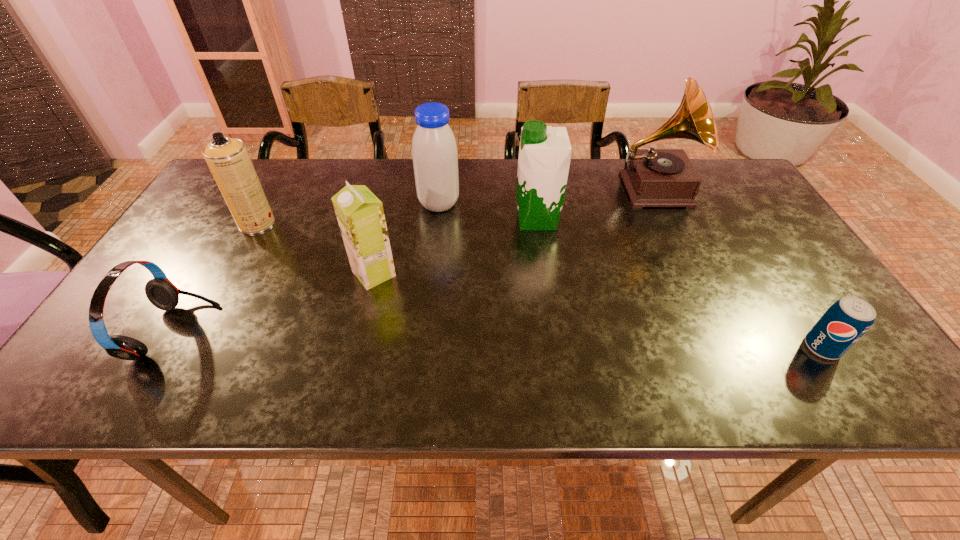
Identify the location of vacant space situated from the horn of the phonograph record. Image resolution: width=960 pixels, height=540 pixels. (695, 278).

Identify the location of vacant space located on the right of the second soya milk from right to left. This screenshot has height=540, width=960. (518, 204).

At what (x,y) coordinates should I click in order to perform the action: click on vacant space situated on the front-facing side of the rightmost soya milk. Please return your answer as a coordinate pair (x, y). Looking at the image, I should click on (452, 220).

This screenshot has width=960, height=540. What are the coordinates of `vacant space situated on the front-facing side of the rightmost soya milk` in the screenshot? It's located at (431, 220).

I want to click on vacant region located 0.340m on the front-facing side of the rightmost soya milk, so click(391, 220).

I want to click on free space located 0.050m on the front of the aerosol can, so click(244, 247).

The width and height of the screenshot is (960, 540). Find the location of `vacant space situated 0.280m on the left of the third object from left to right`. vacant space situated 0.280m on the left of the third object from left to right is located at coordinates (236, 273).

This screenshot has height=540, width=960. I want to click on free location located 0.380m with the microphone attached to the side of the headset, so click(x=384, y=332).

Where is `vacant space located 0.400m on the left of the rightmost object`? vacant space located 0.400m on the left of the rightmost object is located at coordinates (613, 347).

This screenshot has height=540, width=960. What are the coordinates of `phonograph record located in the far edge section of the desktop` in the screenshot? It's located at (652, 177).